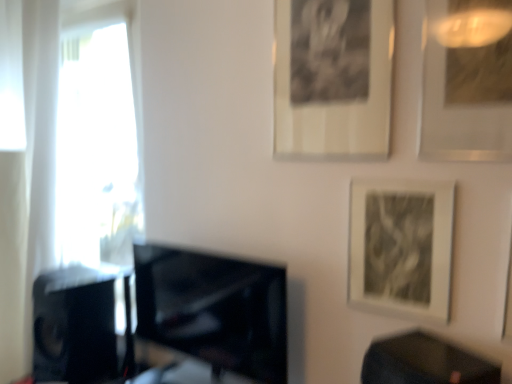
Question: Does black matte speaker at left appear on the left side of black glossy tv at center?

Choices:
 (A) no
 (B) yes

Answer: (B)

Question: From a real-world perspective, is black matte speaker at left beneath black glossy tv at center?

Choices:
 (A) no
 (B) yes

Answer: (B)

Question: Is black matte speaker at left wider than black glossy tv at center?

Choices:
 (A) yes
 (B) no

Answer: (A)

Question: Is black matte speaker at left in front of black glossy tv at center?

Choices:
 (A) no
 (B) yes

Answer: (A)

Question: From the image's perspective, does black matte speaker at left appear lower than black glossy tv at center?

Choices:
 (A) yes
 (B) no

Answer: (A)

Question: Is black matte speaker at left further to the viewer compared to black glossy tv at center?

Choices:
 (A) no
 (B) yes

Answer: (B)

Question: Is black glossy table at lower right completely or partially inside black matte picture frame at upper center, acting as the 3th picture frame starting from the right?

Choices:
 (A) no
 (B) yes

Answer: (A)

Question: Does black matte picture frame at upper center, positioned as the first picture frame in left-to-right order, have a greater height compared to black glossy table at lower right?

Choices:
 (A) yes
 (B) no

Answer: (A)

Question: Is the depth of black matte picture frame at upper center, acting as the 3th picture frame starting from the right, greater than that of black glossy table at lower right?

Choices:
 (A) no
 (B) yes

Answer: (B)

Question: Considering the relative sizes of black matte picture frame at upper center, positioned as the first picture frame in left-to-right order, and black glossy table at lower right in the image provided, is black matte picture frame at upper center, positioned as the first picture frame in left-to-right order, bigger than black glossy table at lower right?

Choices:
 (A) no
 (B) yes

Answer: (A)

Question: Is black matte picture frame at upper center, acting as the 3th picture frame starting from the right, closer to camera compared to black glossy table at lower right?

Choices:
 (A) no
 (B) yes

Answer: (A)

Question: From the image's perspective, is black matte picture frame at upper center, positioned as the first picture frame in left-to-right order, on black glossy table at lower right?

Choices:
 (A) no
 (B) yes

Answer: (B)

Question: Is matte black picture frame at lower right, which is the second picture frame from left to right, not near black glossy table at lower right?

Choices:
 (A) no
 (B) yes

Answer: (A)